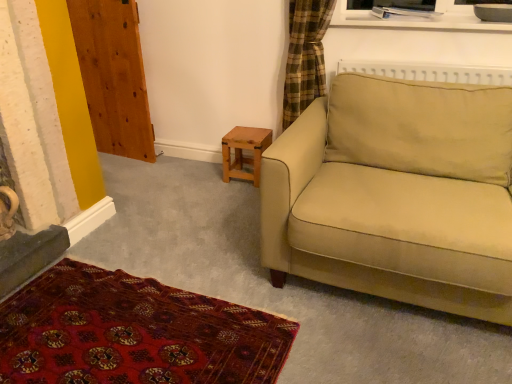
Find the location of a particular element. The height and width of the screenshot is (384, 512). free region on the left part of beige fabric couch at right is located at coordinates (195, 225).